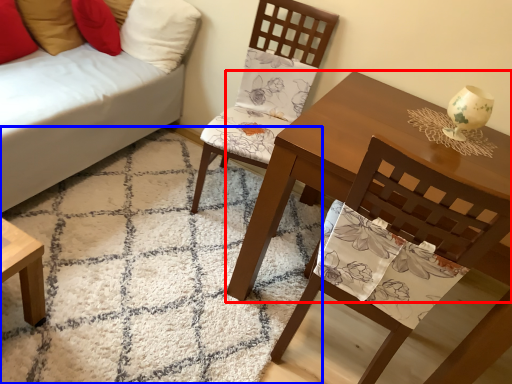
Question: Which point is further to the camera, table (highlighted by a red box) or mat (highlighted by a blue box)?

Choices:
 (A) table
 (B) mat

Answer: (A)